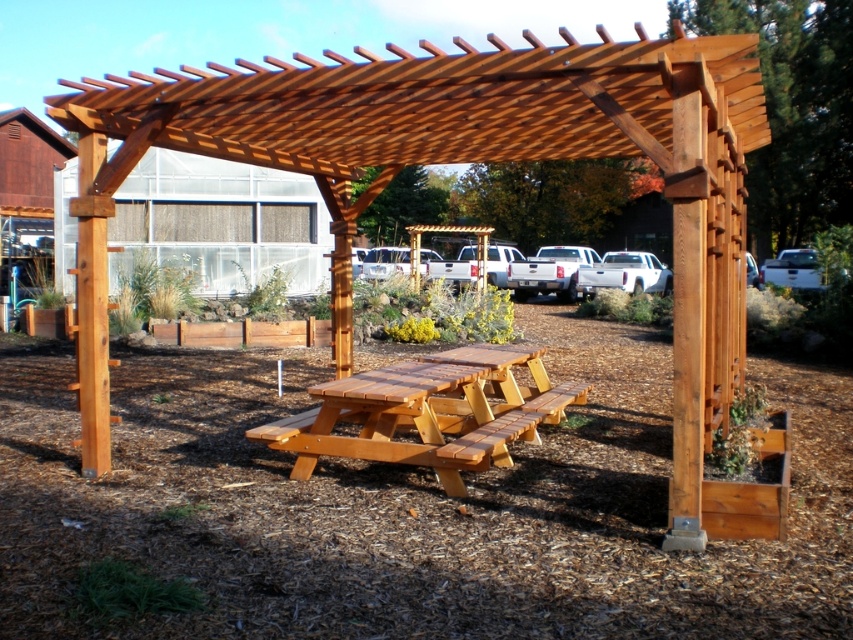
You are planning to set up a small garden party and want to place a 3m long banner between the natural wood pergola at center and the natural wood picnic table at center. Considering their widths, can you determine if the banner will fit horizontally between them without overlapping either structure?

The natural wood pergola at center might be wider than the natural wood picnic table at center, so the banner might not fit properly between them. Check their exact widths before deciding.

You are standing at the base of the pergola looking towards the picnic table. There are two points marked on the structure. Which point, point (605, 112) or point (503, 385), is closer to you?

Point (605, 112) is closer to you than point (503, 385).

You are planning to set up a garden party and want to place a large umbrella between the natural wood pergola at center and the natural wood picnic table at center. Based on their positions, which side of the picnic table should the umbrella be placed on?

The natural wood pergola at center is positioned on the right side of the natural wood picnic table at center, so the umbrella should be placed on the right side of the picnic table to align with the pergola.